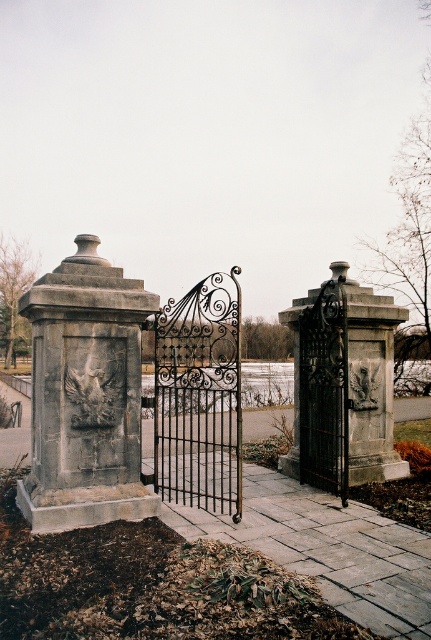
You are a delivery person approaching the entrance. You need to determine which gate is taller to decide which path to take. Which gate is taller between the stone textured gate at right and the black wrought iron gate at center?

The stone textured gate at right is taller than the black wrought iron gate at center according to the description.

You are a delivery person approaching the entrance of a property. You see a gray stone monument at left and a black wrought iron gate at center. Which object is closer to you as you approach the entrance?

The gray stone monument at left is closer to you because it is in front of the black wrought iron gate at center.

In the scene shown: You are standing at point A, which is located at coordinates (86, 394). You want to walk towards the gray stone monument at left. Which direction should you face to walk directly towards it?

You should face towards the gray stone monument at left, which is located at the left side of the scene, so turn left from your current position at point A.